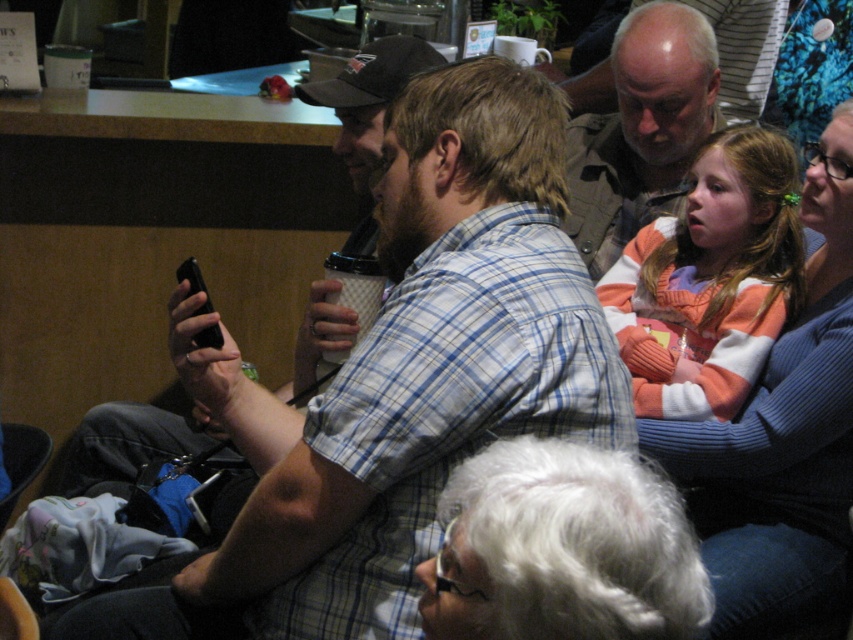
Question: Considering the real-world distances, which object is farthest from the striped sweater at upper right?

Choices:
 (A) orange sweater at upper right
 (B) blue plaid shirt at center
 (C) matte khaki shirt at upper center

Answer: (B)

Question: Observing the image, what is the correct spatial positioning of blue plaid shirt at center in reference to orange sweater at upper right?

Choices:
 (A) above
 (B) below

Answer: (B)

Question: Which point is closer to the camera?

Choices:
 (A) (657, 104)
 (B) (712, 296)

Answer: (B)

Question: Does orange sweater at upper right have a smaller size compared to striped sweater at upper right?

Choices:
 (A) yes
 (B) no

Answer: (B)

Question: Which point is closer to the camera taking this photo?

Choices:
 (A) (517, 211)
 (B) (750, 550)
 (C) (723, 179)
 (D) (631, 141)

Answer: (A)

Question: Is orange sweater at upper right bigger than striped sweater at upper right?

Choices:
 (A) yes
 (B) no

Answer: (A)